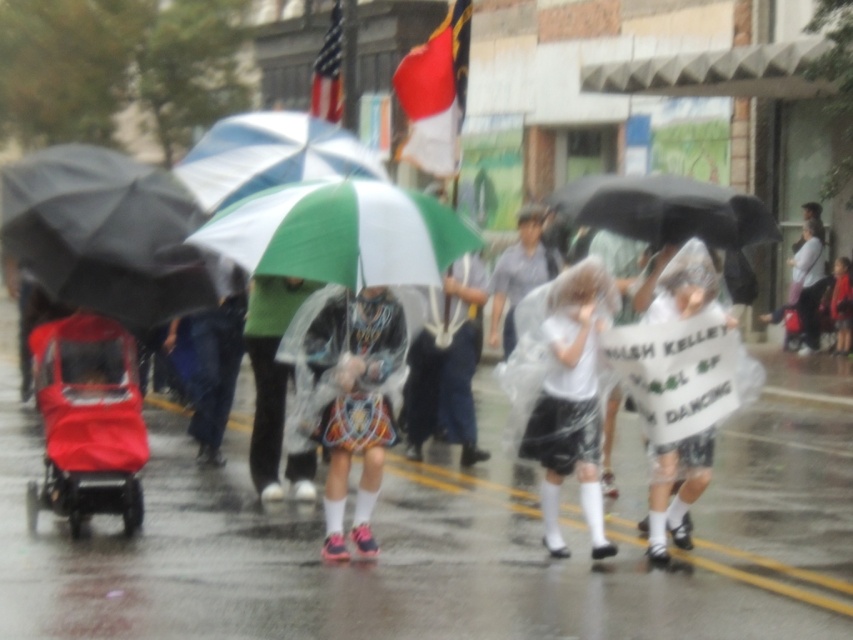
Does wet asphalt at lower center lie behind black matte umbrella at upper center?

No, it is in front of black matte umbrella at upper center.

Identify the location of wet asphalt at lower center. (436, 547).

Find the location of a particular element. wet asphalt at lower center is located at coordinates (436, 547).

Which of these two, black matte umbrella at left or matte colorful skirt at center, stands shorter?

With less height is black matte umbrella at left.

This screenshot has width=853, height=640. What do you see at coordinates (109, 234) in the screenshot?
I see `black matte umbrella at left` at bounding box center [109, 234].

I want to click on black matte umbrella at left, so [109, 234].

Who is lower down, matte colorful skirt at center or american flag at upper center?

matte colorful skirt at center

Can you confirm if matte colorful skirt at center is positioned above american flag at upper center?

No, matte colorful skirt at center is not above american flag at upper center.

Does point (340, 362) come closer to viewer compared to point (311, 106)?

Yes, point (340, 362) is closer to viewer.

What are the coordinates of `matte colorful skirt at center` in the screenshot? It's located at (347, 397).